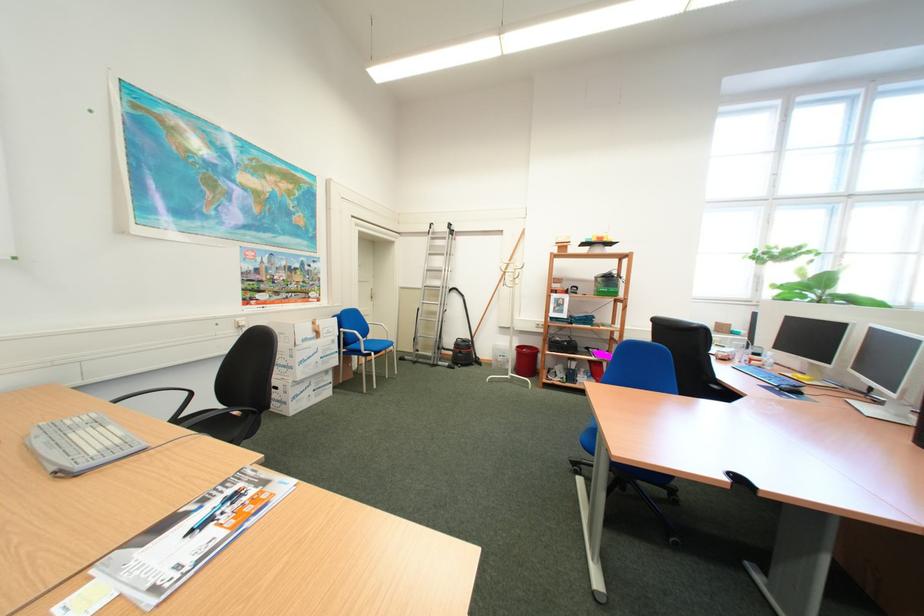
This screenshot has height=616, width=924. What are the coordinates of `blue chair armrest` in the screenshot? It's located at (354, 341).